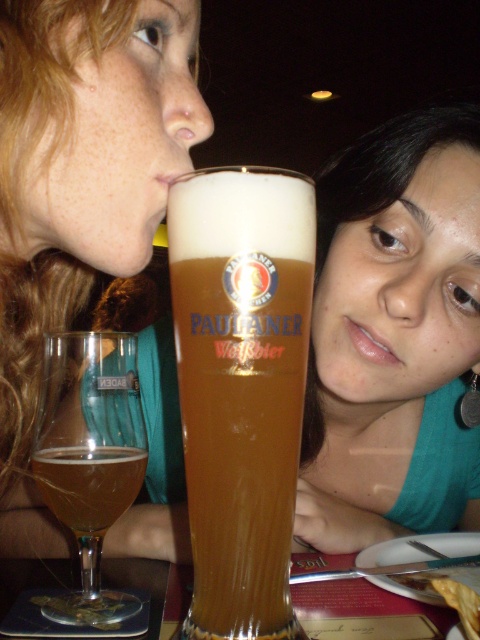
Question: Which object is farther from the camera taking this photo?

Choices:
 (A) amber glass at lower left
 (B) translucent glass beer glass at lower left
 (C) translucent glass coaster at lower left

Answer: (A)

Question: Which point is closer to the camera?

Choices:
 (A) translucent glass coaster at lower left
 (B) translucent glass beer glass at lower left

Answer: (A)

Question: Is matte black hair at upper left bigger than translucent glass beer glass at lower left?

Choices:
 (A) no
 (B) yes

Answer: (B)

Question: Can you confirm if translucent glass beer glass at lower left is positioned below amber glass at lower left?

Choices:
 (A) no
 (B) yes

Answer: (A)

Question: Which point is closer to the camera taking this photo?

Choices:
 (A) (239, 236)
 (B) (28, 419)
 (C) (136, 566)

Answer: (A)

Question: Is matte black hair at upper left closer to the viewer compared to translucent glass coaster at lower left?

Choices:
 (A) yes
 (B) no

Answer: (A)